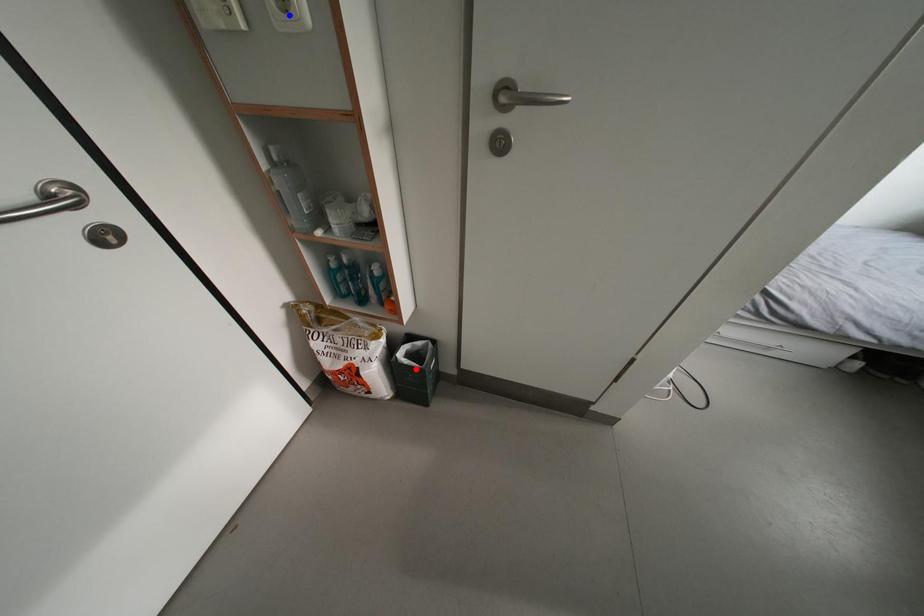
Question: Two points are marked on the image. Which point is closer to the camera?

Choices:
 (A) Blue point is closer.
 (B) Red point is closer.

Answer: (A)